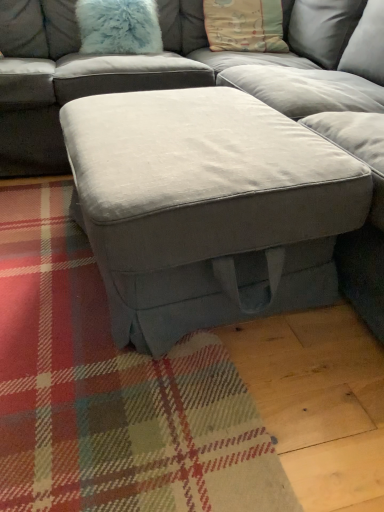
Question: Does suede gray ottoman at center have a greater height compared to fuzzy light blue pillow at upper left, the first pillow viewed from the left?

Choices:
 (A) yes
 (B) no

Answer: (A)

Question: Can you confirm if suede gray ottoman at center is wider than fuzzy light blue pillow at upper left, which ranks as the second pillow in right-to-left order?

Choices:
 (A) no
 (B) yes

Answer: (B)

Question: Does suede gray ottoman at center have a larger size compared to fuzzy light blue pillow at upper left, the first pillow viewed from the left?

Choices:
 (A) no
 (B) yes

Answer: (B)

Question: From the image's perspective, is suede gray ottoman at center on fuzzy light blue pillow at upper left, which ranks as the second pillow in right-to-left order?

Choices:
 (A) no
 (B) yes

Answer: (A)

Question: Are suede gray ottoman at center and fuzzy light blue pillow at upper left, the first pillow viewed from the left, located far from each other?

Choices:
 (A) no
 (B) yes

Answer: (A)

Question: Considering the positions of pastel cotton pillow at upper center, arranged as the first pillow when viewed from the right, and fuzzy light blue pillow at upper left, which ranks as the second pillow in right-to-left order, in the image, is pastel cotton pillow at upper center, arranged as the first pillow when viewed from the right, bigger or smaller than fuzzy light blue pillow at upper left, which ranks as the second pillow in right-to-left order,?

Choices:
 (A) big
 (B) small

Answer: (A)

Question: Considering the positions of pastel cotton pillow at upper center, arranged as the first pillow when viewed from the right, and fuzzy light blue pillow at upper left, which ranks as the second pillow in right-to-left order, in the image, is pastel cotton pillow at upper center, arranged as the first pillow when viewed from the right, wider or thinner than fuzzy light blue pillow at upper left, which ranks as the second pillow in right-to-left order,?

Choices:
 (A) wide
 (B) thin

Answer: (A)

Question: Is pastel cotton pillow at upper center, arranged as the first pillow when viewed from the right, to the left or to the right of fuzzy light blue pillow at upper left, the first pillow viewed from the left, in the image?

Choices:
 (A) left
 (B) right

Answer: (B)

Question: Is pastel cotton pillow at upper center, arranged as the first pillow when viewed from the right, taller or shorter than fuzzy light blue pillow at upper left, the first pillow viewed from the left?

Choices:
 (A) tall
 (B) short

Answer: (A)

Question: Is suede gray ottoman at center wider or thinner than pastel cotton pillow at upper center, the second pillow in the left-to-right sequence?

Choices:
 (A) wide
 (B) thin

Answer: (A)

Question: Relative to pastel cotton pillow at upper center, arranged as the first pillow when viewed from the right, is suede gray ottoman at center in front or behind?

Choices:
 (A) behind
 (B) front

Answer: (B)

Question: Is point (x=264, y=121) closer or farther from the camera than point (x=263, y=50)?

Choices:
 (A) farther
 (B) closer

Answer: (B)

Question: Looking at the image, does suede gray ottoman at center seem bigger or smaller compared to pastel cotton pillow at upper center, arranged as the first pillow when viewed from the right?

Choices:
 (A) big
 (B) small

Answer: (A)

Question: From a real-world perspective, is pastel cotton pillow at upper center, arranged as the first pillow when viewed from the right, physically located above or below suede gray ottoman at center?

Choices:
 (A) above
 (B) below

Answer: (A)

Question: Is pastel cotton pillow at upper center, the second pillow in the left-to-right sequence, inside or outside of suede gray ottoman at center?

Choices:
 (A) outside
 (B) inside

Answer: (A)